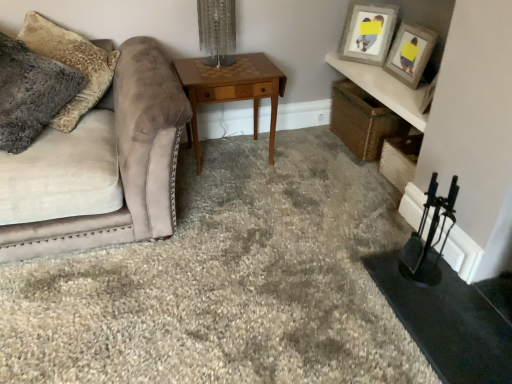
Question: From a real-world perspective, is clear glass table lamp at center above or below matte gray picture frame at upper right, which appears as the first picture frame when viewed from the left?

Choices:
 (A) above
 (B) below

Answer: (A)

Question: Is clear glass table lamp at center situated inside matte gray picture frame at upper right, which appears as the first picture frame when viewed from the left, or outside?

Choices:
 (A) outside
 (B) inside

Answer: (A)

Question: Which object is positioned farthest from the fuzzy gray pillow at left?

Choices:
 (A) matte gray picture frame at upper right, which appears as the first picture frame when viewed from the left
 (B) clear glass table lamp at center
 (C) woodenobject at center
 (D) matte gray picture frame at upper right, arranged as the 2th picture frame when viewed from the left
 (E) suede couch at left

Answer: (D)

Question: Which is farther from the suede couch at left?

Choices:
 (A) matte gray picture frame at upper right, arranged as the second picture frame when viewed from the right
 (B) fuzzy gray pillow at left
 (C) clear glass table lamp at center
 (D) matte gray picture frame at upper right, arranged as the 2th picture frame when viewed from the left
 (E) woodenobject at center

Answer: (D)